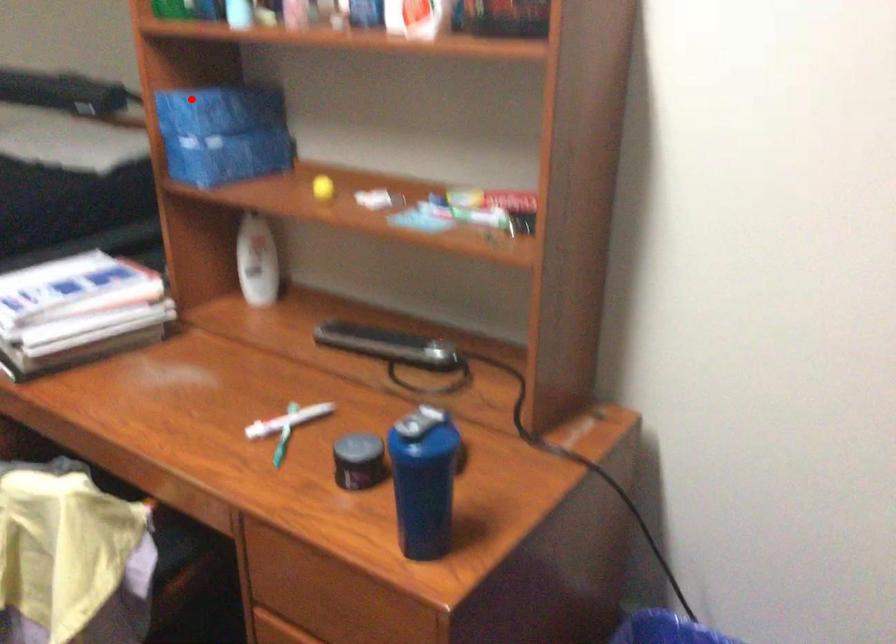
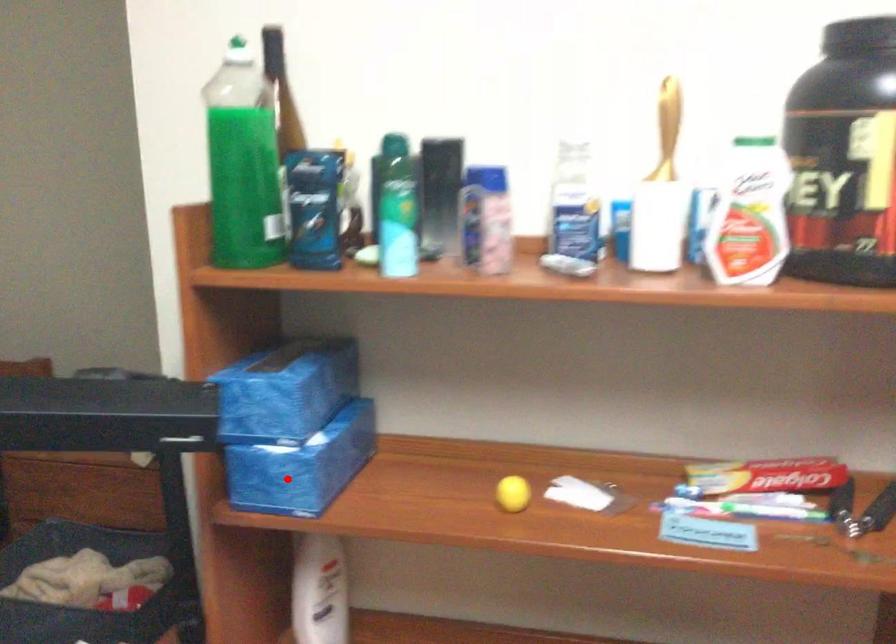
I am providing you with two images of the same scene from different viewpoints. A red point is marked on the first image and another point is marked on the second image. Are the points marked in image1 and image2 representing the same 3D position?

No